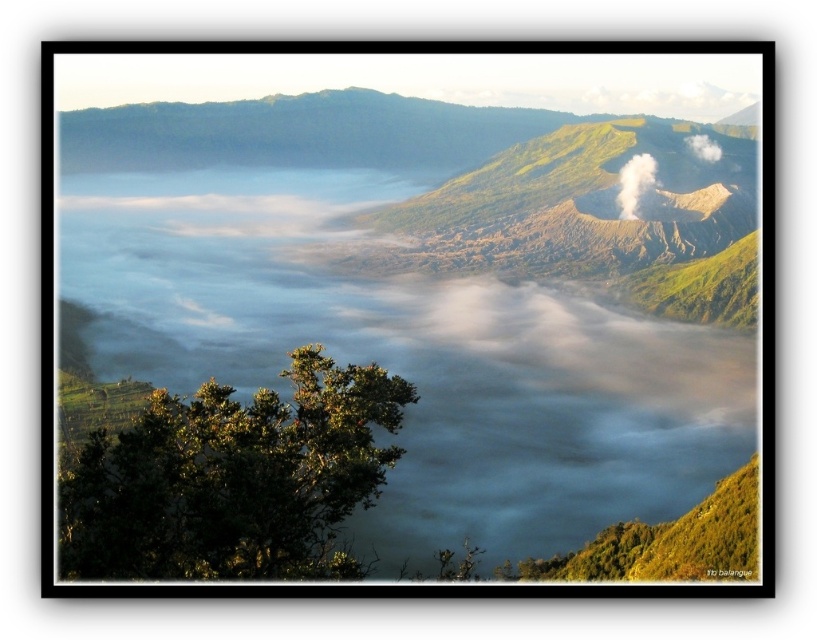
You are an environmental scientist observing the volcanic crater. You notice the green leafy tree at lower left and the white smoke at upper center. Which object is located higher in the image?

The white smoke at upper center is higher in the image than the green leafy tree at lower left.

You are a drone operator tasked with capturing aerial footage of the volcanic crater. Your drone is currently positioned at point A, which is at coordinates 0.3, 0.3. You need to fly it to the white misty cloud at center to capture a close shot. According to the scene description, what are the coordinates you should navigate to?

The white misty cloud at center is located at point (435,291), so you should navigate the drone to coordinates (435,291) to reach it.

What is the 2D coordinate of the green leafy tree at lower left in the image?

The 2D coordinate of the green leafy tree at lower left is at point (x=231, y=477).